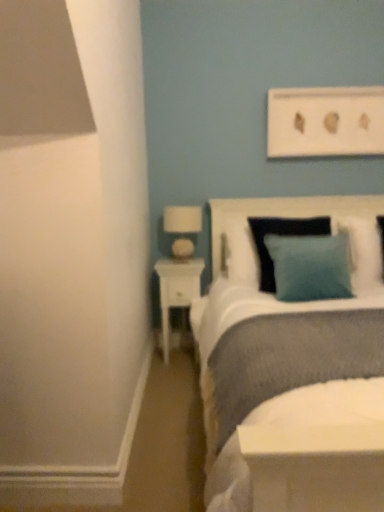
Question: Can you confirm if teal fabric pillow at upper right, positioned as the 1th pillow in back-to-front order, is taller than textured white headboard at upper right?

Choices:
 (A) yes
 (B) no

Answer: (B)

Question: From the image's perspective, is teal fabric pillow at upper right, which ranks as the 2th pillow in front-to-back order, below textured white headboard at upper right?

Choices:
 (A) yes
 (B) no

Answer: (B)

Question: Is teal fabric pillow at upper right, positioned as the 1th pillow in back-to-front order, wider than textured white headboard at upper right?

Choices:
 (A) no
 (B) yes

Answer: (A)

Question: Considering the relative sizes of teal fabric pillow at upper right, which is the first pillow in right-to-left order, and textured white headboard at upper right in the image provided, is teal fabric pillow at upper right, which is the first pillow in right-to-left order, bigger than textured white headboard at upper right?

Choices:
 (A) yes
 (B) no

Answer: (B)

Question: Does teal fabric pillow at upper right, positioned as the 1th pillow in back-to-front order, turn towards textured white headboard at upper right?

Choices:
 (A) yes
 (B) no

Answer: (B)

Question: In the image, is white fabric lampshade at upper left positioned in front of or behind teal fabric pillow at upper right, which is the first pillow in right-to-left order?

Choices:
 (A) behind
 (B) front

Answer: (A)

Question: In the image, is white fabric lampshade at upper left on the left side or the right side of teal fabric pillow at upper right, which ranks as the 2th pillow in front-to-back order?

Choices:
 (A) left
 (B) right

Answer: (A)

Question: In terms of height, does white fabric lampshade at upper left look taller or shorter compared to teal fabric pillow at upper right, the 2th pillow viewed from the left?

Choices:
 (A) tall
 (B) short

Answer: (B)

Question: From a real-world perspective, is white fabric lampshade at upper left above or below teal fabric pillow at upper right, the 2th pillow viewed from the left?

Choices:
 (A) below
 (B) above

Answer: (B)

Question: Does point (175, 224) appear closer or farther from the camera than point (258, 211)?

Choices:
 (A) farther
 (B) closer

Answer: (A)

Question: Do you think white fabric lampshade at upper left is within textured white headboard at upper right, or outside of it?

Choices:
 (A) inside
 (B) outside

Answer: (B)

Question: Is white fabric lampshade at upper left taller or shorter than textured white headboard at upper right?

Choices:
 (A) short
 (B) tall

Answer: (A)

Question: In terms of width, does white fabric lampshade at upper left look wider or thinner when compared to textured white headboard at upper right?

Choices:
 (A) wide
 (B) thin

Answer: (B)

Question: Considering the positions of textured white headboard at upper right and white glossy nightstand at lower left in the image, is textured white headboard at upper right wider or thinner than white glossy nightstand at lower left?

Choices:
 (A) thin
 (B) wide

Answer: (B)

Question: Is point (345, 205) positioned closer to the camera than point (195, 275)?

Choices:
 (A) farther
 (B) closer

Answer: (B)